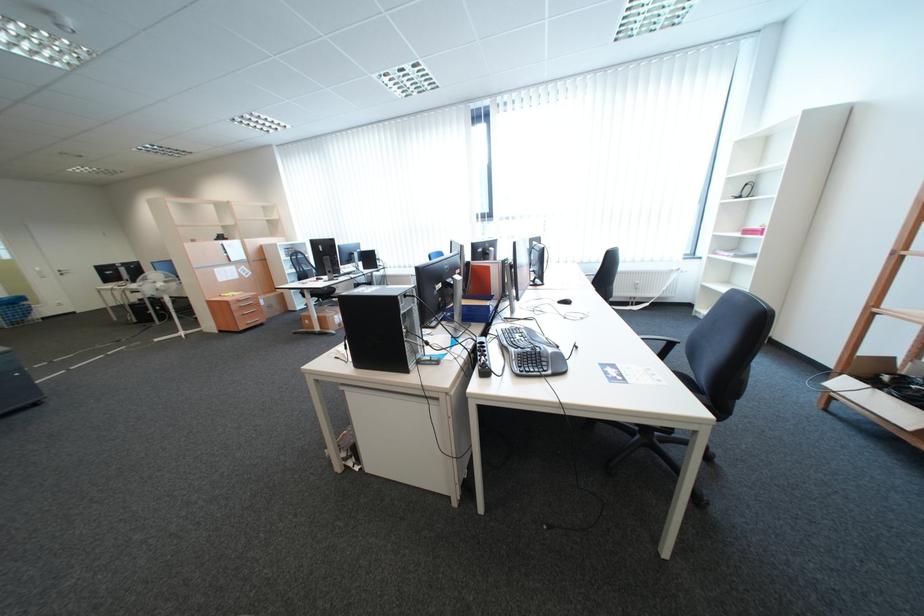
Where is `silver door handle`? The height and width of the screenshot is (616, 924). silver door handle is located at coordinates (63, 272).